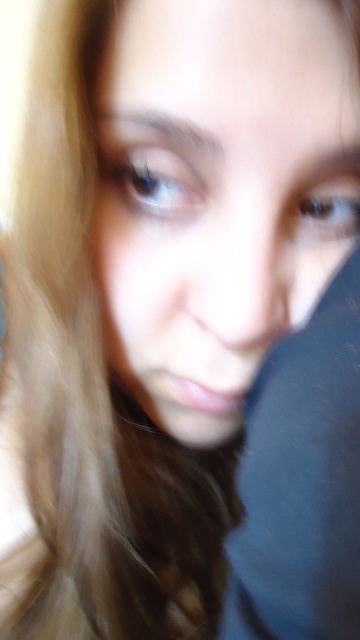
Question: Which object appears farthest from the camera in this image?

Choices:
 (A) blue glossy eye at upper right
 (B) blue glossy eye at upper left

Answer: (A)

Question: Is smooth skin face at center smaller than blue glossy eye at upper left?

Choices:
 (A) yes
 (B) no

Answer: (B)

Question: Considering the relative positions of smooth skin face at center and blue glossy eye at upper right in the image provided, where is smooth skin face at center located with respect to blue glossy eye at upper right?

Choices:
 (A) left
 (B) right

Answer: (A)

Question: Which point appears closest to the camera in this image?

Choices:
 (A) (344, 221)
 (B) (118, 156)

Answer: (B)

Question: Which point is closer to the camera?

Choices:
 (A) blue glossy eye at upper left
 (B) smooth skin face at center
 (C) blue glossy eye at upper right

Answer: (B)

Question: Is smooth skin face at center wider than blue glossy eye at upper left?

Choices:
 (A) yes
 (B) no

Answer: (A)